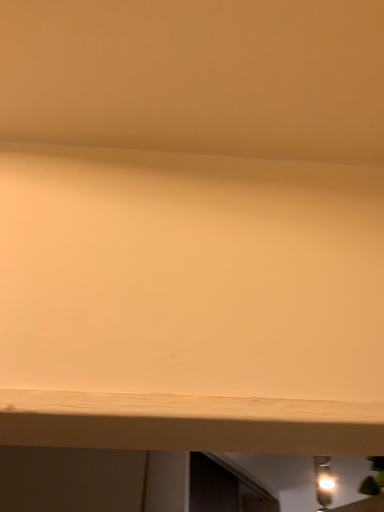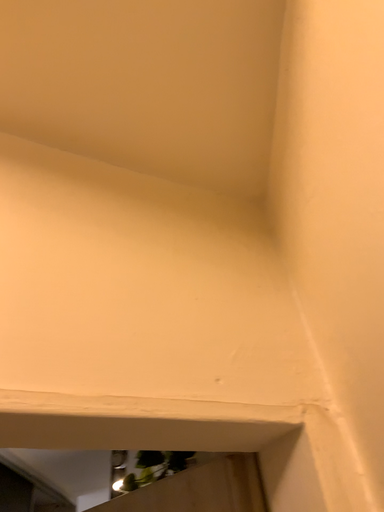
Question: How did the camera likely rotate when shooting the video?

Choices:
 (A) rotated right
 (B) rotated left

Answer: (A)